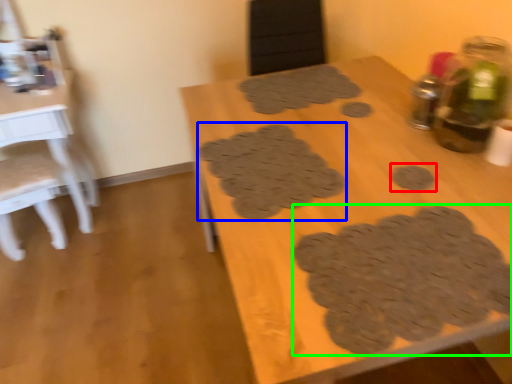
Question: Which is farther away from footprint (highlighted by a red box)? footprint (highlighted by a blue box) or footprint (highlighted by a green box)?

Choices:
 (A) footprint
 (B) footprint

Answer: (A)